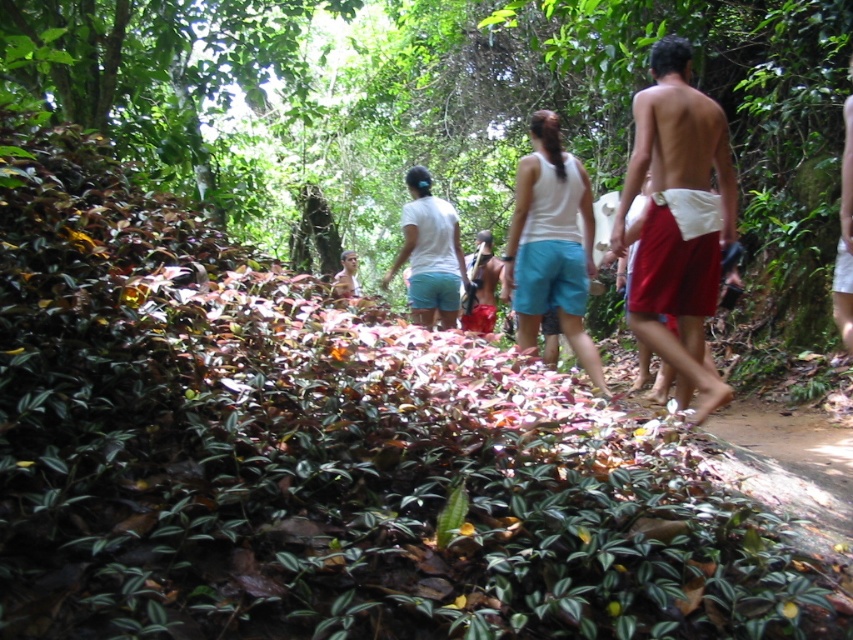
Question: Which object appears farthest from the camera in this image?

Choices:
 (A) white fabric shorts at center
 (B) red fabric shorts at right
 (C) white cotton shirt at center

Answer: (C)

Question: Which object is farther from the camera taking this photo?

Choices:
 (A) white cotton shirt at center
 (B) white fabric shorts at center

Answer: (A)

Question: Is white fabric shorts at center to the left of white cotton shirt at center from the viewer's perspective?

Choices:
 (A) no
 (B) yes

Answer: (A)

Question: Does red fabric shorts at right come in front of white fabric shorts at center?

Choices:
 (A) no
 (B) yes

Answer: (B)

Question: Which object is closer to the camera taking this photo?

Choices:
 (A) red fabric shorts at right
 (B) white fabric shorts at center
 (C) white cotton shirt at center

Answer: (A)

Question: Can you confirm if white fabric shorts at center is positioned to the left of white cotton shirt at center?

Choices:
 (A) no
 (B) yes

Answer: (A)